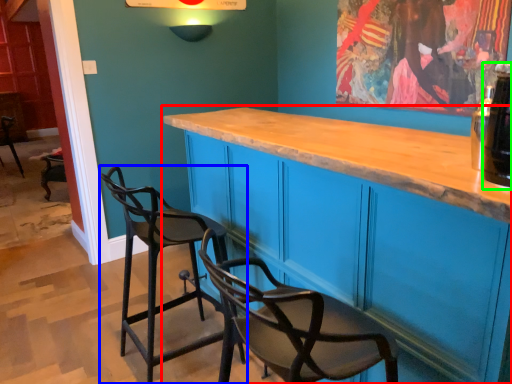
Question: Considering the real-world distances, which object is closest to cabinetry (highlighted by a red box)? chair (highlighted by a blue box) or beverage (highlighted by a green box).

Choices:
 (A) chair
 (B) beverage

Answer: (A)